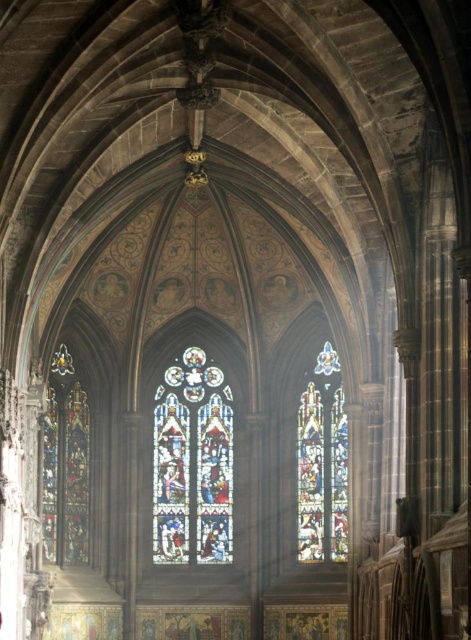
Is stained glass window at center bigger than multicolored stained glass at center?

Yes.

Is the position of stained glass window at center more distant than that of multicolored stained glass at center?

Yes, stained glass window at center is behind multicolored stained glass at center.

Find the location of a particular element. stained glass window at center is located at coordinates (195, 461).